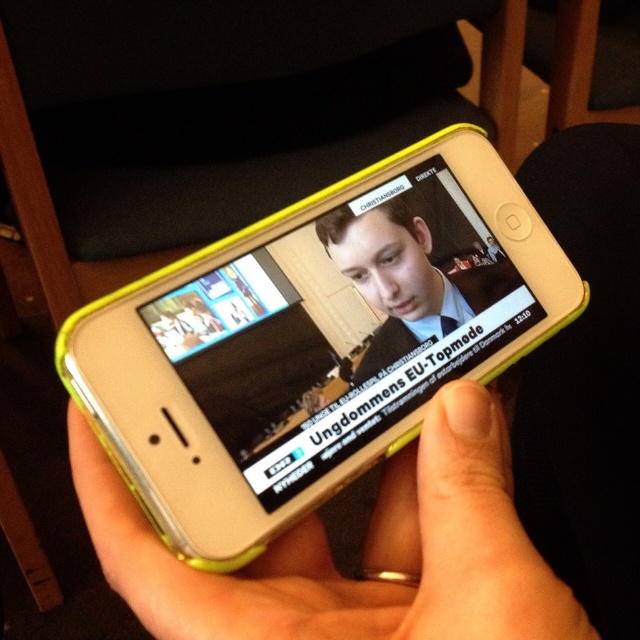
What is the object located at the coordinates point (310,342) in the image?

The point (310,342) corresponds to the yellow plastic smartphone at center.

You are holding a yellow plastic smartphone at center and a matte plastic hand at center. Which object is closer to you?

The yellow plastic smartphone at center is closer to you than the matte plastic hand at center.

You are holding a yellow plastic smartphone at center in your hand and notice a matte plastic hand at center nearby. Which object is located to the left of the other?

The yellow plastic smartphone at center is positioned on the right side of matte plastic hand at center, so the matte plastic hand at center is to the left of the yellow plastic smartphone at center.